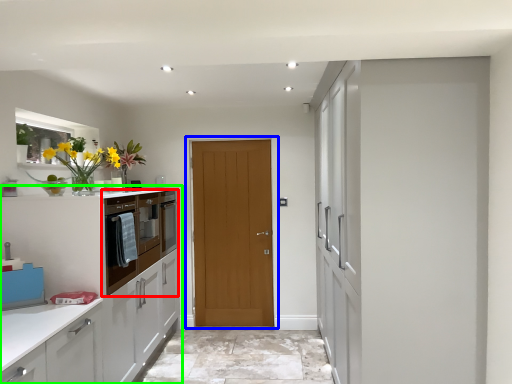
Question: Considering the real-world distances, which object is closest to cabinetry (highlighted by a red box)? door (highlighted by a blue box) or cabinetry (highlighted by a green box).

Choices:
 (A) door
 (B) cabinetry

Answer: (B)